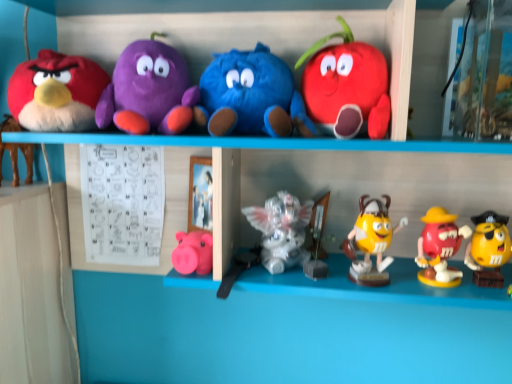
Question: Considering the positions of yellow glossy m&m figure at center, arranged as the 8th toy when viewed from the left, and blue plush toy at center, positioned as the 5th toy in left-to-right order, in the image, is yellow glossy m&m figure at center, arranged as the 8th toy when viewed from the left, taller or shorter than blue plush toy at center, positioned as the 5th toy in left-to-right order,?

Choices:
 (A) short
 (B) tall

Answer: (A)

Question: From a real-world perspective, is yellow glossy m&m figure at center, acting as the third toy starting from the right, physically located above or below blue plush toy at center, positioned as the 5th toy in left-to-right order?

Choices:
 (A) below
 (B) above

Answer: (A)

Question: Which object is the farthest from the yellow matte m&m's character at lower right, the first toy positioned from the right?

Choices:
 (A) matte pink piggy bank at lower center, which is the 7th toy in right-to-left order
 (B) purple plush toy at upper left, which appears as the eighth toy when viewed from the right
 (C) matte plush toy at upper right, the 4th toy in the right-to-left sequence
 (D) translucent plastic angel at center, arranged as the 5th toy when viewed from the right
 (E) brown plush toy at left, the 1th toy from the left

Answer: (E)

Question: Considering the real-world distances, which object is closest to the matte plush toy at upper right, marked as the 7th toy in a left-to-right arrangement?

Choices:
 (A) brown plush toy at left, the 1th toy from the left
 (B) purple plush toy at upper left, which appears as the eighth toy when viewed from the right
 (C) rubberized red m&m figure at lower right, which is the ninth toy in left-to-right order
 (D) yellow matte m&m's character at lower right, which appears as the 10th toy when viewed from the left
 (E) blue plush toy at center, the 6th toy viewed from the right

Answer: (E)